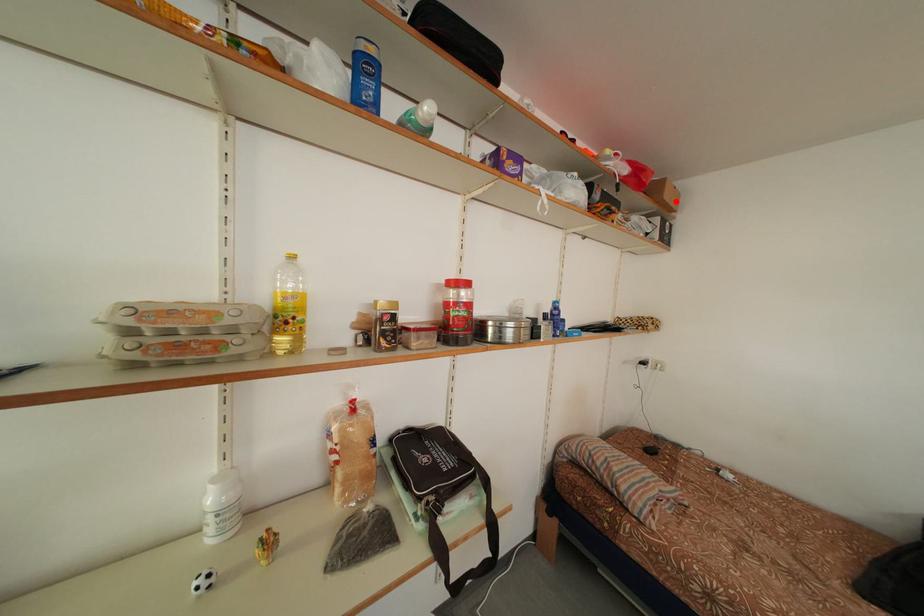
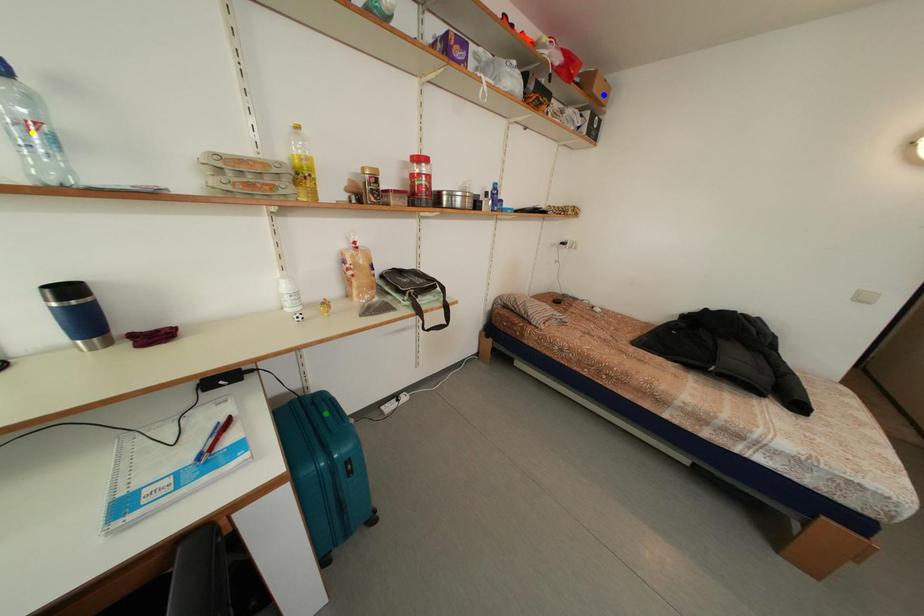
Question: I am providing you with two images of the same scene from different viewpoints. A red point is marked on the first image. You are given multiple points on the second image. Which point in image 2 represents the same 3d spot as the red point in image 1?

Choices:
 (A) green point
 (B) yellow point
 (C) blue point

Answer: (C)